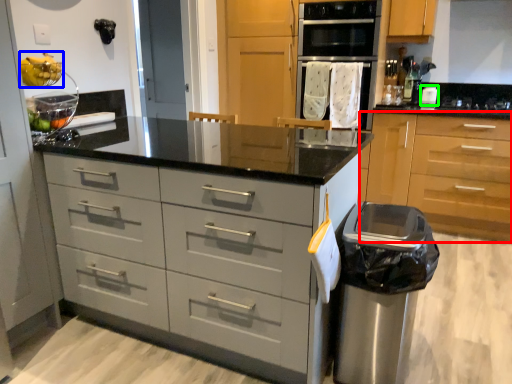
Question: Considering the real-world distances, which object is farthest from cabinetry (highlighted by a red box)? fruit (highlighted by a blue box) or kitchen appliance (highlighted by a green box)?

Choices:
 (A) fruit
 (B) kitchen appliance

Answer: (A)